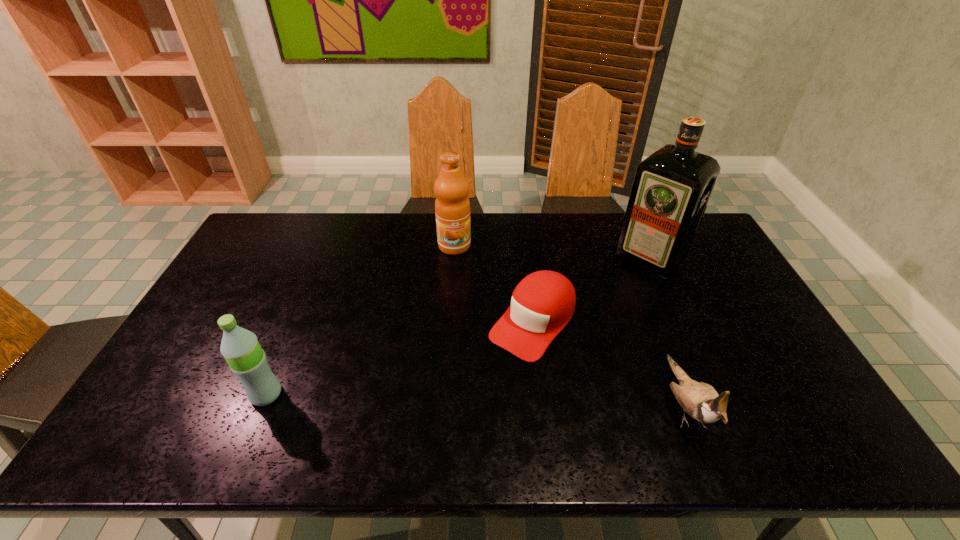
You are a GUI agent. You are given a task and a screenshot of the screen. Output one action in this format:
    pyautogui.click(x=<x>, y=<y>)
    Task: Click on the free space located on the label side of the second tallest object
    
    Given the screenshot: What is the action you would take?
    (457, 275)

Identify the location of free region located on the label side of the second tallest object. (463, 345).

The height and width of the screenshot is (540, 960). Identify the location of vacant space located on the front-facing side of the shortest object. (492, 374).

I want to click on free space located 0.220m on the front-facing side of the shortest object, so click(458, 413).

This screenshot has width=960, height=540. Find the location of `vacant space situated on the front-facing side of the shortest object`. vacant space situated on the front-facing side of the shortest object is located at coordinates click(x=477, y=390).

At what (x,y) coordinates should I click in order to perform the action: click on blank space located 0.270m on the front label of the liquor. Please return your answer as a coordinate pair (x, y). This screenshot has width=960, height=540. Looking at the image, I should click on (588, 319).

This screenshot has height=540, width=960. I want to click on vacant space located on the front label of the liquor, so click(570, 336).

The height and width of the screenshot is (540, 960). What are the coordinates of `free space located 0.070m on the front label of the liquor` in the screenshot? It's located at (622, 285).

This screenshot has width=960, height=540. Identify the location of fruit juice that is positioned at the far edge. (452, 206).

At what (x,y) coordinates should I click in order to perform the action: click on liquor present at the far edge. Please return your answer as a coordinate pair (x, y). The height and width of the screenshot is (540, 960). Looking at the image, I should click on click(x=671, y=189).